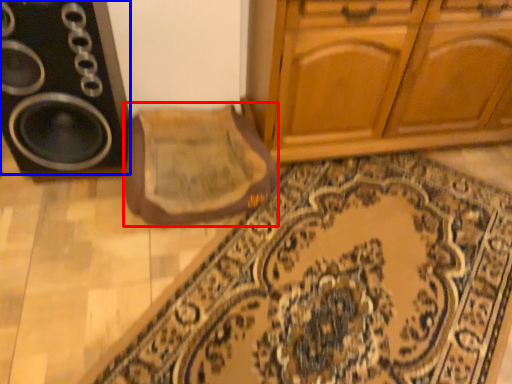
Question: Which object is further to the camera taking this photo, mat (highlighted by a red box) or speaker (highlighted by a blue box)?

Choices:
 (A) mat
 (B) speaker

Answer: (A)